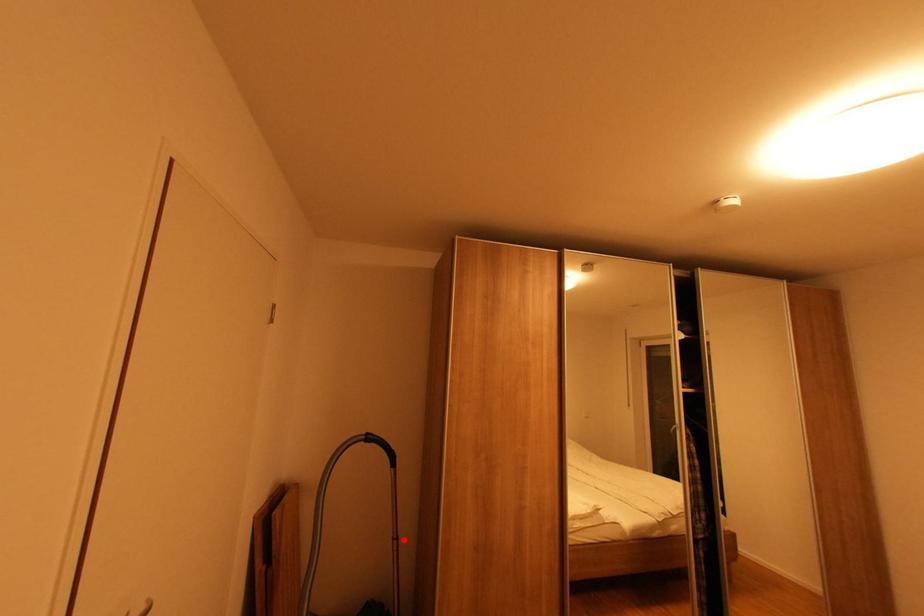
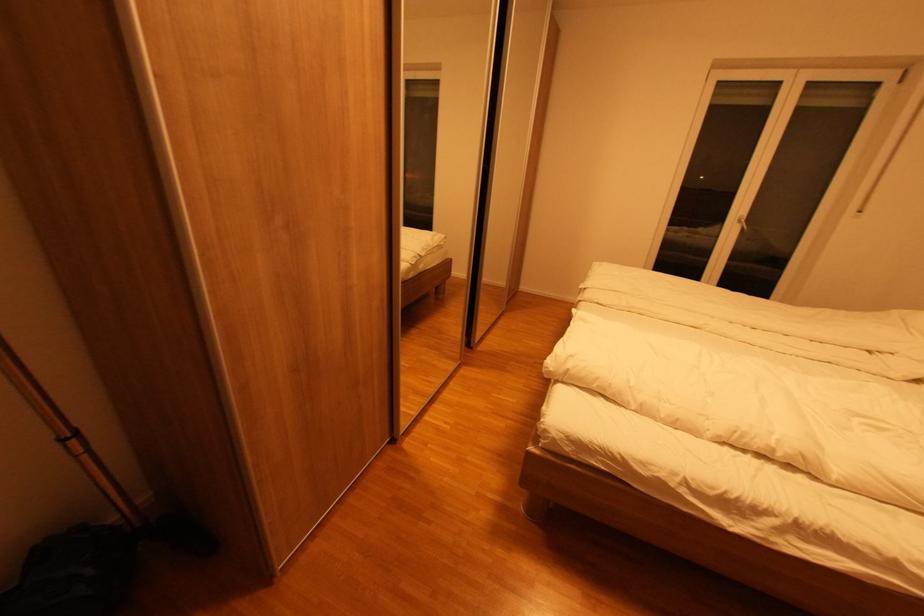
Where in the second image is the point corresponding to the highlighted location from the first image?

(83, 434)